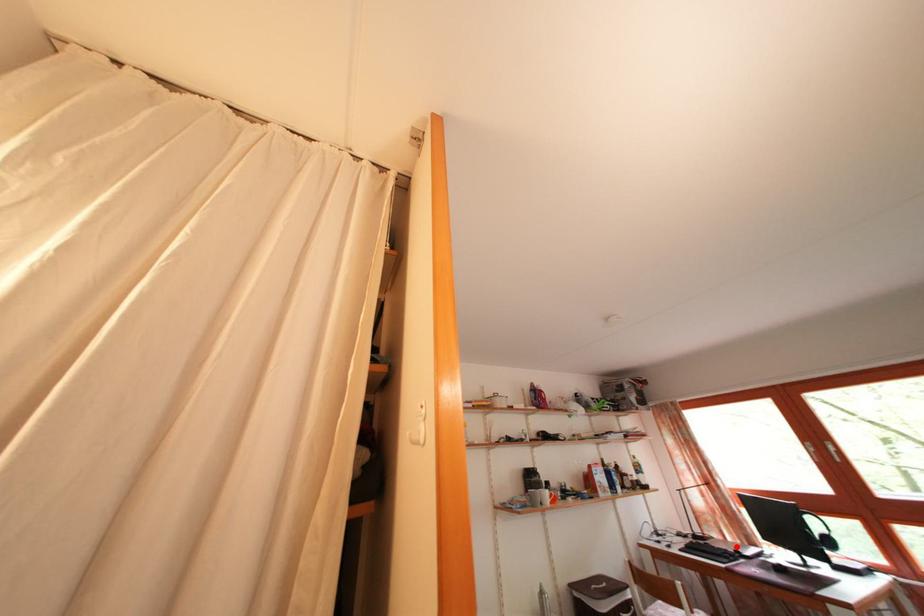
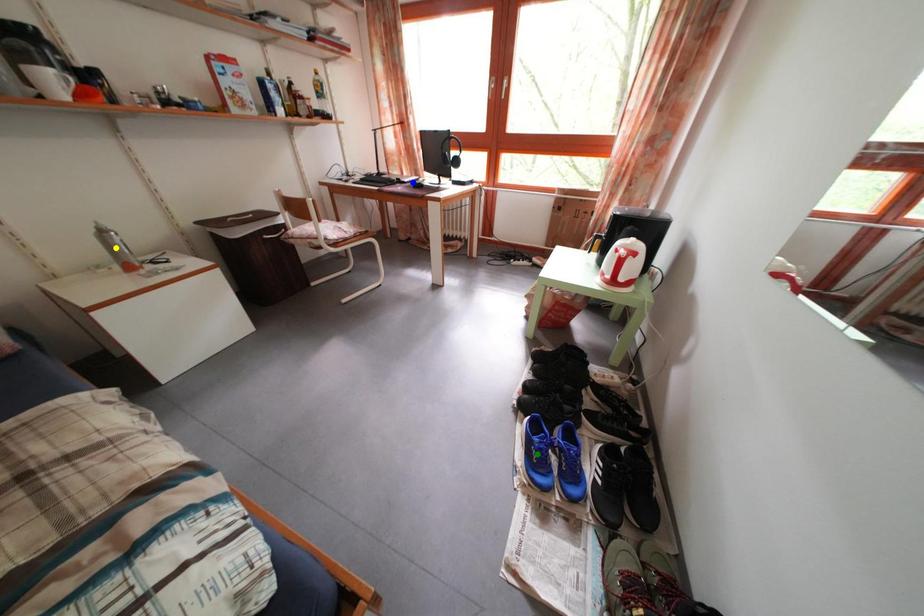
Question: I am providing you with two images of the same scene from different viewpoints. A red point is marked on the first image. You are given multiple points on the second image. Which point in image 2 represents the same 3d spot as the red point in image 1?

Choices:
 (A) blue point
 (B) yellow point
 (C) green point

Answer: (A)